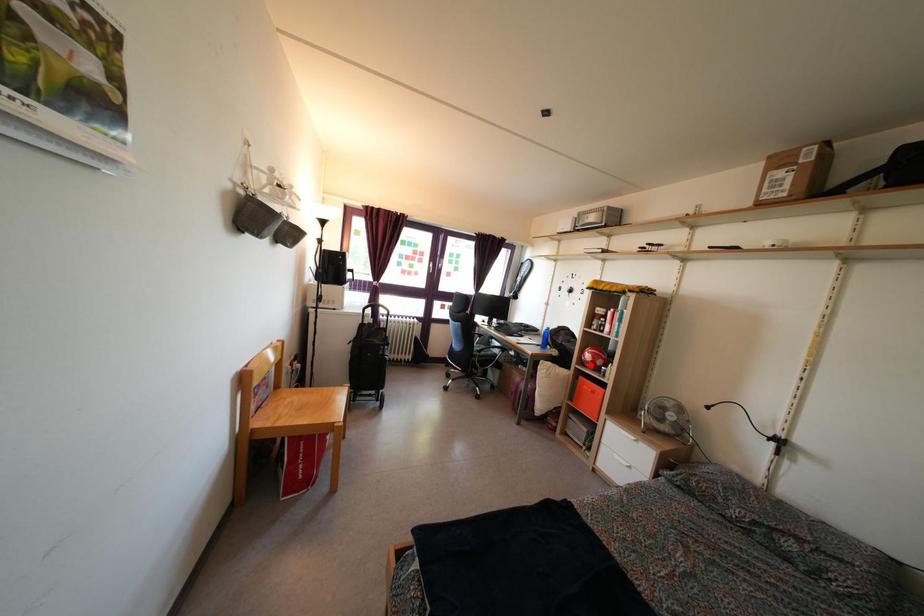
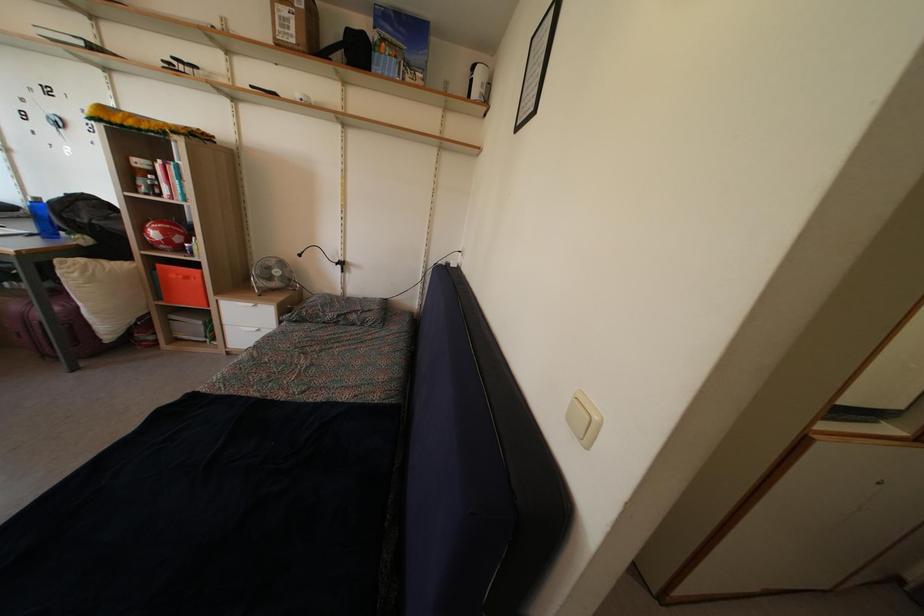
Find the pixel in the second image that matches the highlighted location in the first image.

(157, 243)